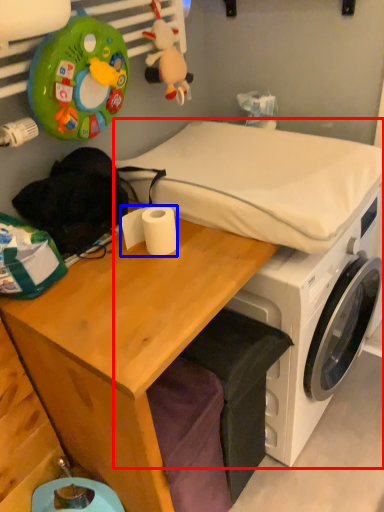
Question: Which object is further to the camera taking this photo, machine (highlighted by a red box) or toilet paper (highlighted by a blue box)?

Choices:
 (A) machine
 (B) toilet paper

Answer: (A)